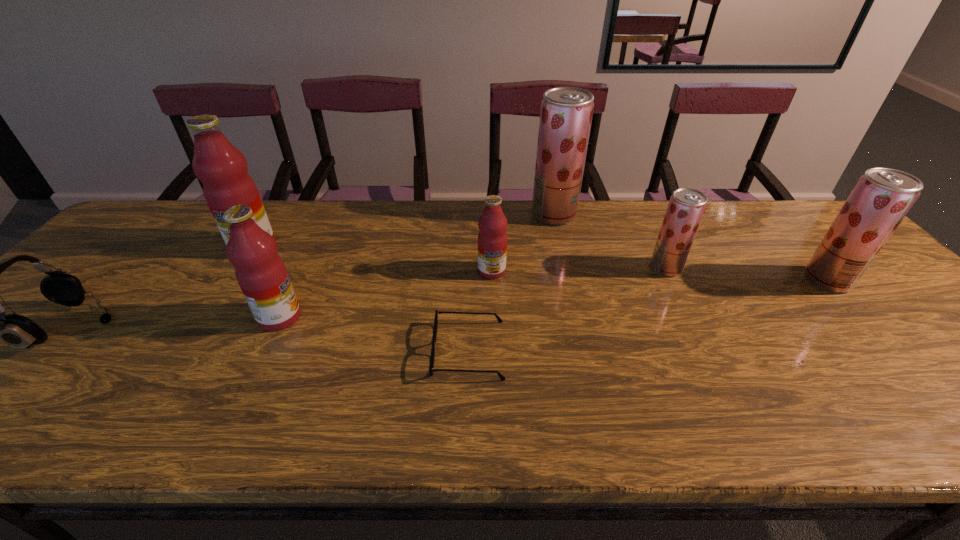
Identify the location of the smallest pink fruit juice. The height and width of the screenshot is (540, 960). (492, 238).

Where is `the rightmost pink fruit juice`? the rightmost pink fruit juice is located at coordinates (492, 238).

Image resolution: width=960 pixels, height=540 pixels. Find the location of `the seventh tallest object`. the seventh tallest object is located at coordinates (19, 332).

Locate an element on the screen. The height and width of the screenshot is (540, 960). the leftmost object is located at coordinates (19, 332).

Locate an element on the screen. spectacles is located at coordinates (431, 369).

Locate an element on the screen. This screenshot has height=540, width=960. vacant area located on the front of the third fruit juice from right to left is located at coordinates (575, 308).

Where is `vacant position located 0.240m on the label of the leftmost fruit juice`? vacant position located 0.240m on the label of the leftmost fruit juice is located at coordinates (204, 323).

Locate an element on the screen. This screenshot has width=960, height=540. vacant space situated on the right of the rightmost object is located at coordinates (879, 280).

The height and width of the screenshot is (540, 960). I want to click on vacant space situated 0.370m on the label of the nearest fruit juice, so click(454, 317).

At what (x,y) coordinates should I click in order to perform the action: click on free space located 0.270m on the left of the second object from right to left. Please return your answer as a coordinate pair (x, y). The height and width of the screenshot is (540, 960). Looking at the image, I should click on (551, 268).